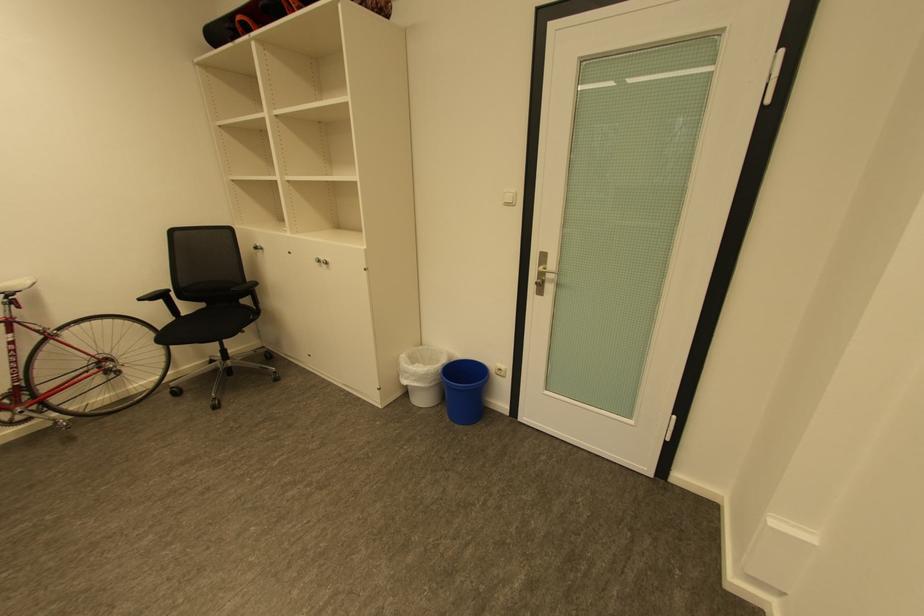
Where would you pull the silver door handle? Please return your answer as a coordinate pair (x, y).

(541, 273)